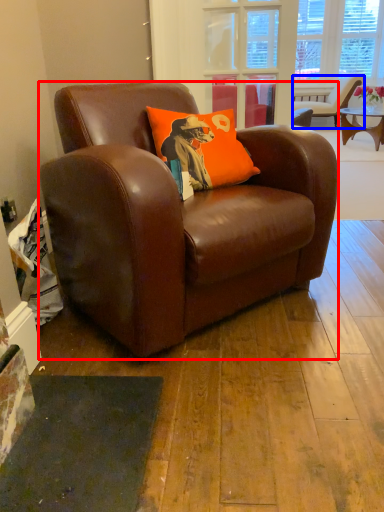
Question: Which of the following is the closest to the observer, chair (highlighted by a red box) or chair (highlighted by a blue box)?

Choices:
 (A) chair
 (B) chair

Answer: (A)